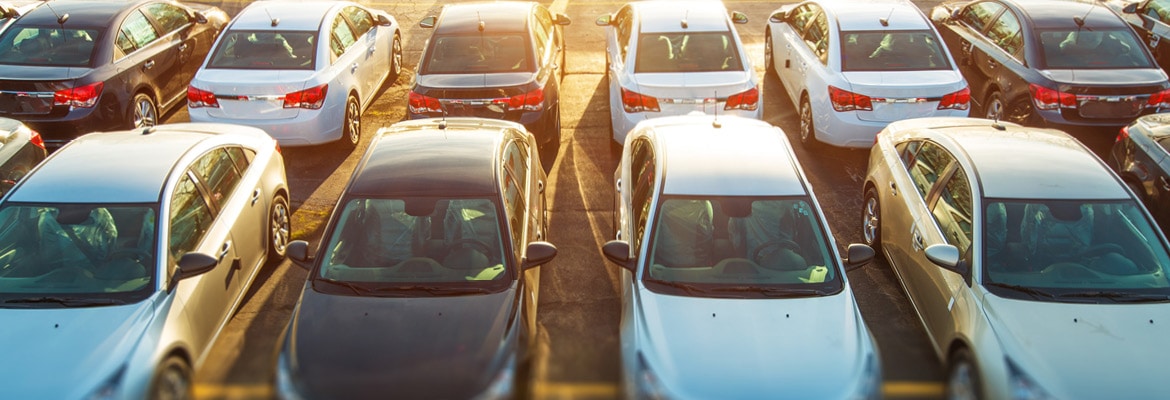
The width and height of the screenshot is (1170, 400). Identify the location of hoods. (70, 341), (367, 368), (769, 371), (1072, 368).